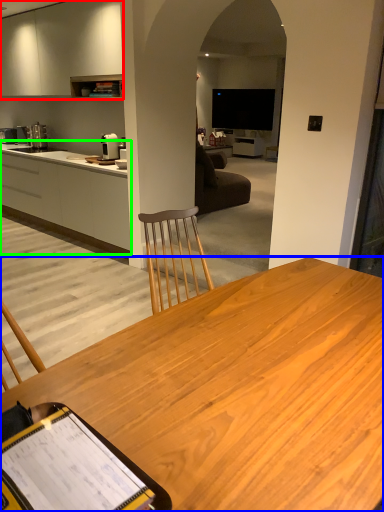
Question: Which is nearer to the cabinetry (highlighted by a red box)? desk (highlighted by a blue box) or cabinetry (highlighted by a green box).

Choices:
 (A) desk
 (B) cabinetry

Answer: (B)